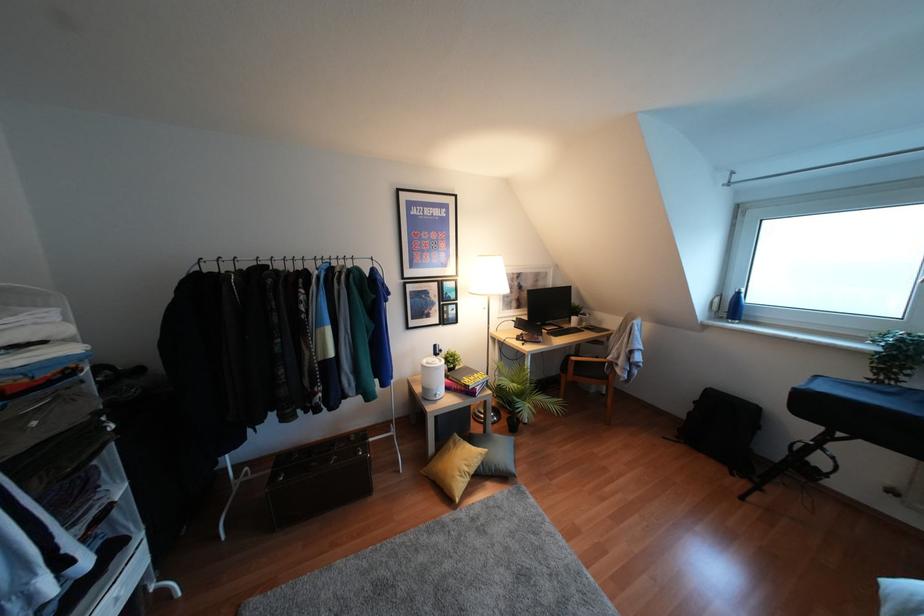
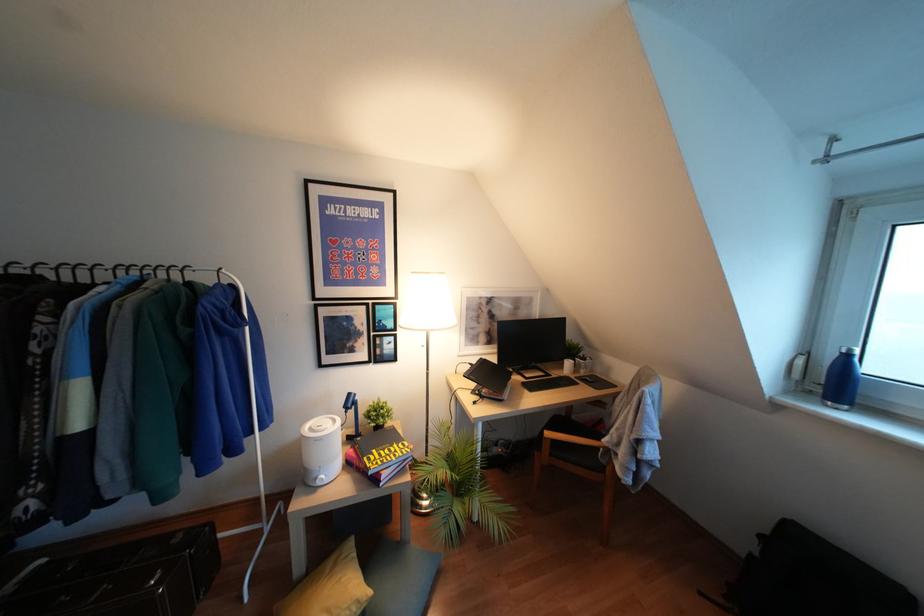
What movement of the cameraman would produce the second image?

The cameraman walked toward right, forward.